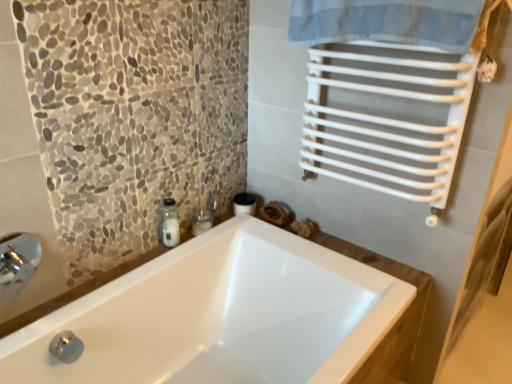
Question: Is silver metallic faucet at lower left further to the viewer compared to white glossy bathtub at center?

Choices:
 (A) no
 (B) yes

Answer: (B)

Question: Is silver metallic faucet at lower left facing towards white glossy bathtub at center?

Choices:
 (A) no
 (B) yes

Answer: (A)

Question: Can you confirm if silver metallic faucet at lower left is positioned to the right of white glossy bathtub at center?

Choices:
 (A) yes
 (B) no

Answer: (B)

Question: Considering the relative positions of silver metallic faucet at lower left and white glossy bathtub at center in the image provided, is silver metallic faucet at lower left to the left of white glossy bathtub at center from the viewer's perspective?

Choices:
 (A) no
 (B) yes

Answer: (B)

Question: Is silver metallic faucet at lower left closer to camera compared to white glossy bathtub at center?

Choices:
 (A) no
 (B) yes

Answer: (A)

Question: Is white glossy bathtub at center completely or partially inside silver metallic faucet at lower left?

Choices:
 (A) no
 (B) yes

Answer: (A)

Question: Does silver metallic faucet at lower left have a greater height compared to clear glass jar at upper left?

Choices:
 (A) yes
 (B) no

Answer: (B)

Question: From a real-world perspective, is silver metallic faucet at lower left physically above clear glass jar at upper left?

Choices:
 (A) no
 (B) yes

Answer: (B)

Question: Are silver metallic faucet at lower left and clear glass jar at upper left located far from each other?

Choices:
 (A) yes
 (B) no

Answer: (B)

Question: Does silver metallic faucet at lower left appear on the right side of clear glass jar at upper left?

Choices:
 (A) yes
 (B) no

Answer: (B)

Question: Does silver metallic faucet at lower left have a smaller size compared to clear glass jar at upper left?

Choices:
 (A) yes
 (B) no

Answer: (B)

Question: Does silver metallic faucet at lower left have a greater width compared to clear glass jar at upper left?

Choices:
 (A) yes
 (B) no

Answer: (A)

Question: Could you tell me if white glossy bathtub at center is facing clear glass jar at upper left?

Choices:
 (A) no
 (B) yes

Answer: (A)